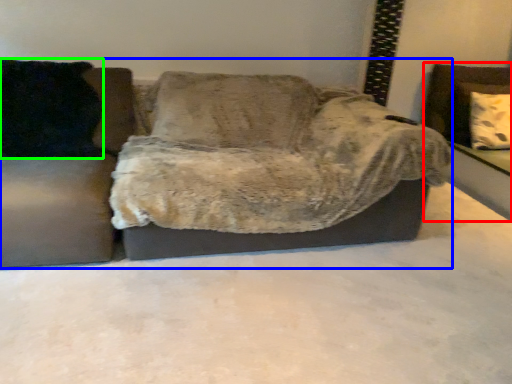
Question: Which is nearer to the swivel chair (highlighted by a red box)? studio couch (highlighted by a blue box) or pillow (highlighted by a green box).

Choices:
 (A) studio couch
 (B) pillow

Answer: (A)